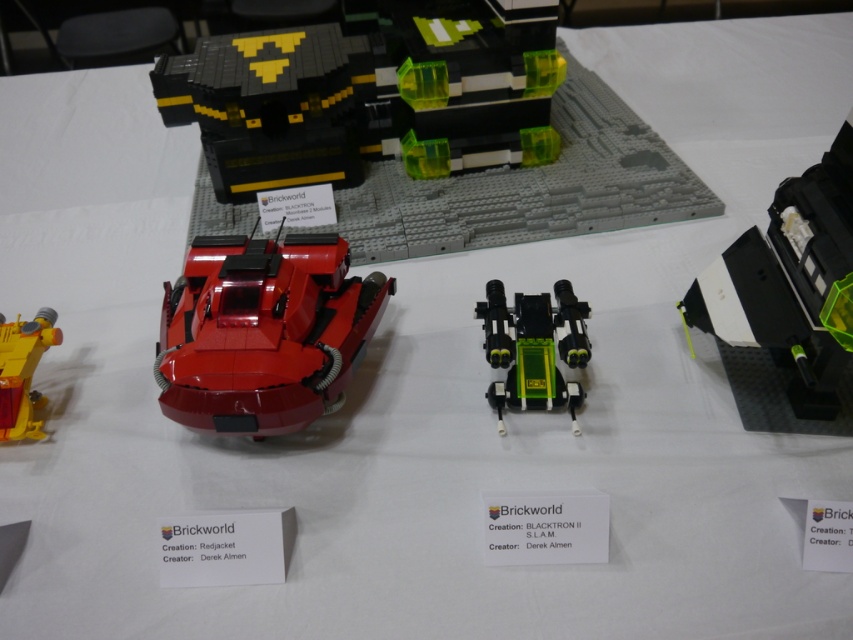
Question: Estimate the real-world distances between objects in this image. Which object is farther from the black matte/transparent plastic at right?

Choices:
 (A) yellow plastic helicopter at left
 (B) green matte/transparent plastic tank at center

Answer: (A)

Question: Which object appears closest to the camera in this image?

Choices:
 (A) black matte/black plastic building at upper center
 (B) green matte/transparent plastic tank at center

Answer: (B)

Question: Does shiny red car at center appear on the left side of yellow plastic helicopter at left?

Choices:
 (A) yes
 (B) no

Answer: (B)

Question: Can you confirm if black matte/black plastic building at upper center is wider than green matte/transparent plastic tank at center?

Choices:
 (A) yes
 (B) no

Answer: (A)

Question: Estimate the real-world distances between objects in this image. Which object is farther from the shiny red car at center?

Choices:
 (A) black matte/transparent plastic at right
 (B) black matte/black plastic building at upper center

Answer: (A)

Question: Is shiny red car at center positioned behind green matte/transparent plastic tank at center?

Choices:
 (A) no
 (B) yes

Answer: (A)